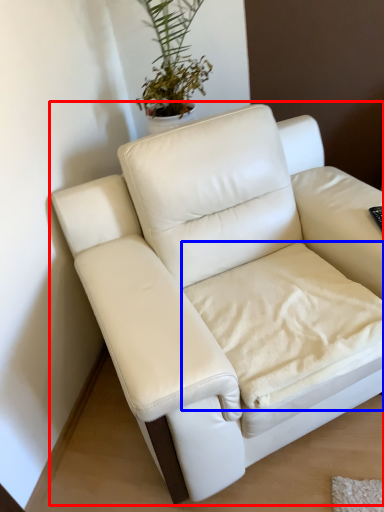
Question: Which point is closer to the camera, studio couch (highlighted by a red box) or sheet (highlighted by a blue box)?

Choices:
 (A) studio couch
 (B) sheet

Answer: (A)